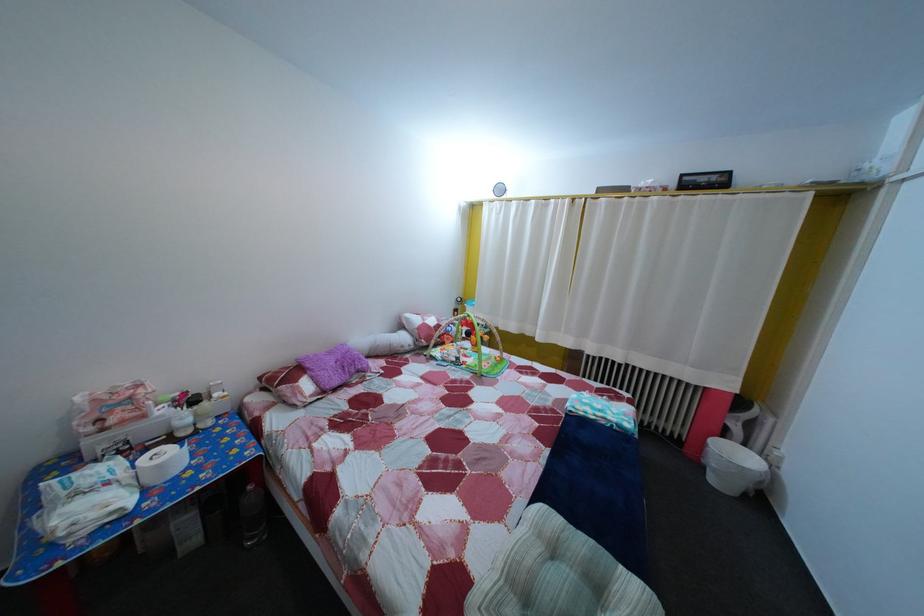
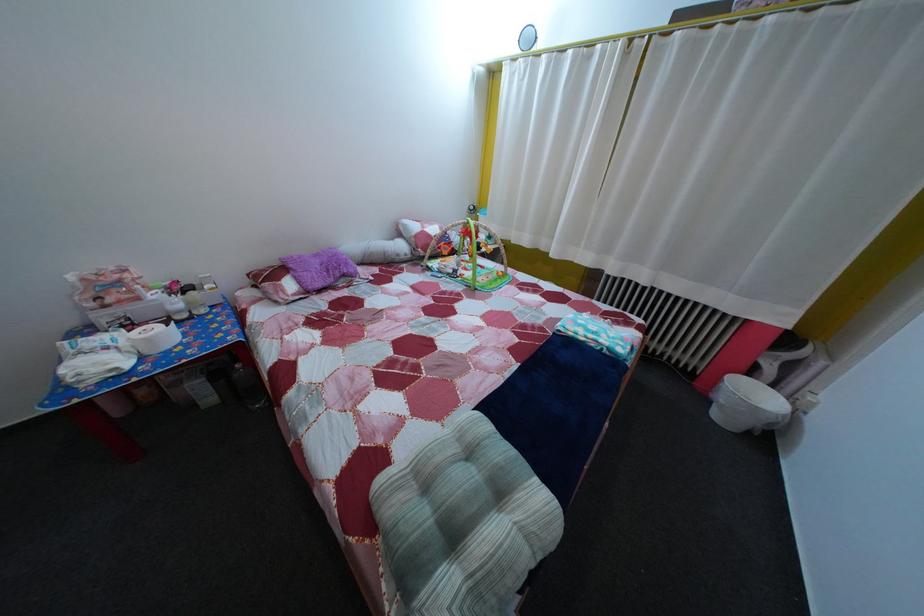
In the second image, find the point that corresponds to pixel 169 475 in the first image.

(157, 347)